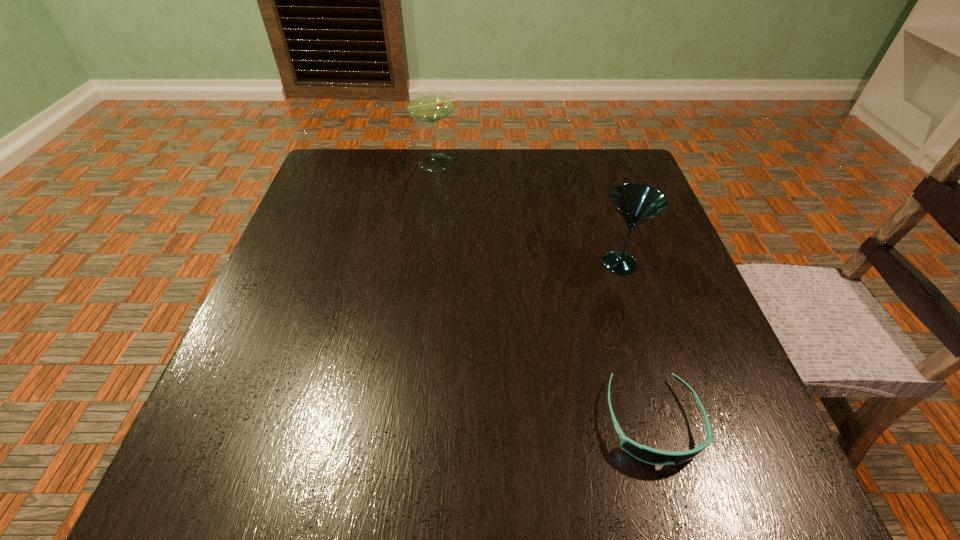
Identify which object is the second closest to the second tallest object. Please provide its 2D coordinates. Your answer should be formatted as a tuple, i.e. [(x, y)], where the tuple contains the x and y coordinates of a point satisfying the conditions above.

[(432, 104)]